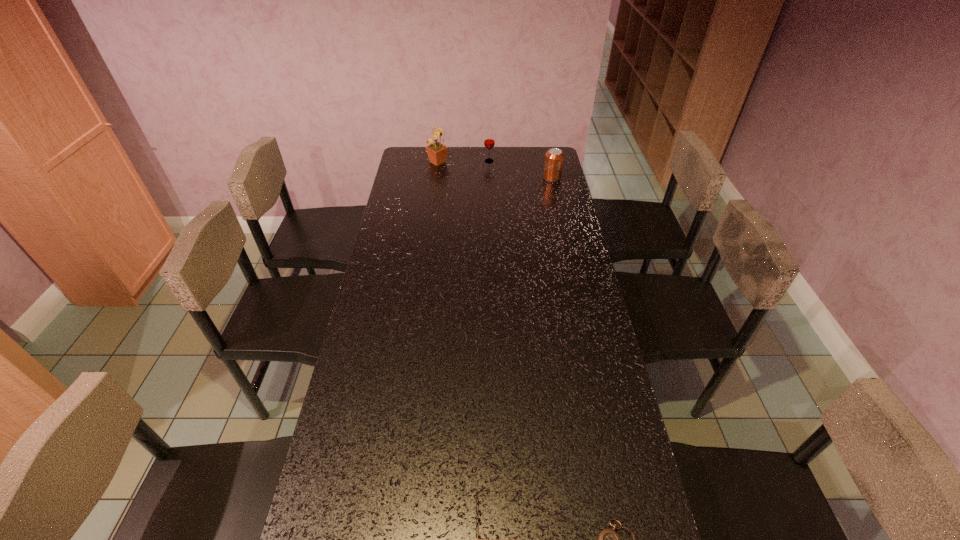
Locate an element on the screen. This screenshot has width=960, height=540. the leftmost object is located at coordinates (437, 152).

Locate an element on the screen. the tallest object is located at coordinates (437, 152).

Identify the location of can. The height and width of the screenshot is (540, 960). (554, 157).

Where is `glass`? The height and width of the screenshot is (540, 960). glass is located at coordinates (489, 141).

Where is `vacant point located at the front of the tallest object with flowers visible`? vacant point located at the front of the tallest object with flowers visible is located at coordinates (532, 162).

This screenshot has height=540, width=960. In order to click on free location located on the front of the third farthest object in this screenshot , I will do `click(562, 225)`.

Image resolution: width=960 pixels, height=540 pixels. What are the coordinates of `vacant area located 0.200m on the left of the glass` in the screenshot? It's located at (443, 161).

At what (x,y) coordinates should I click in order to perform the action: click on sunflower positioned at the far edge. Please return your answer as a coordinate pair (x, y). The width and height of the screenshot is (960, 540). Looking at the image, I should click on (437, 152).

Where is `glass that is at the far edge`? The height and width of the screenshot is (540, 960). glass that is at the far edge is located at coordinates (489, 141).

Locate an element on the screen. Image resolution: width=960 pixels, height=540 pixels. object situated at the left edge is located at coordinates (437, 152).